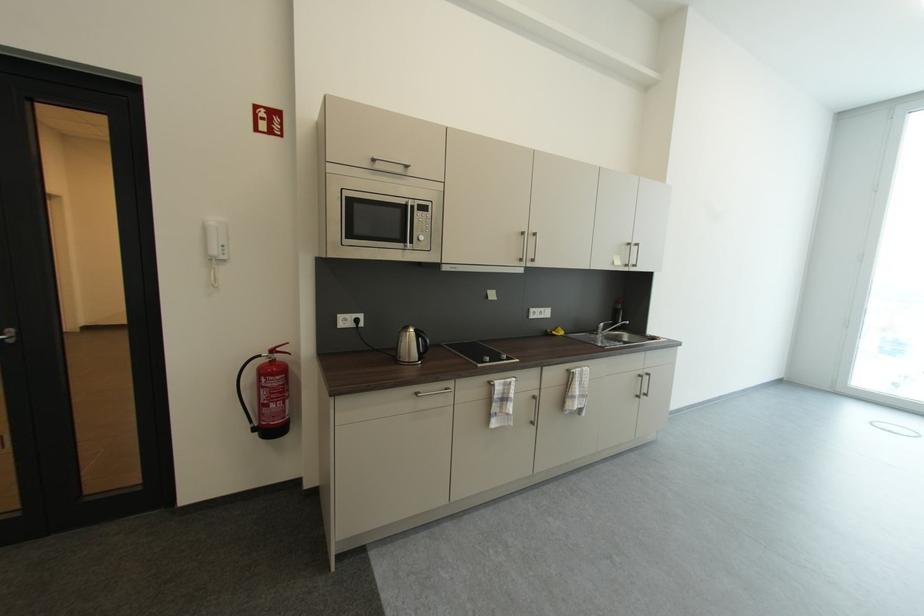
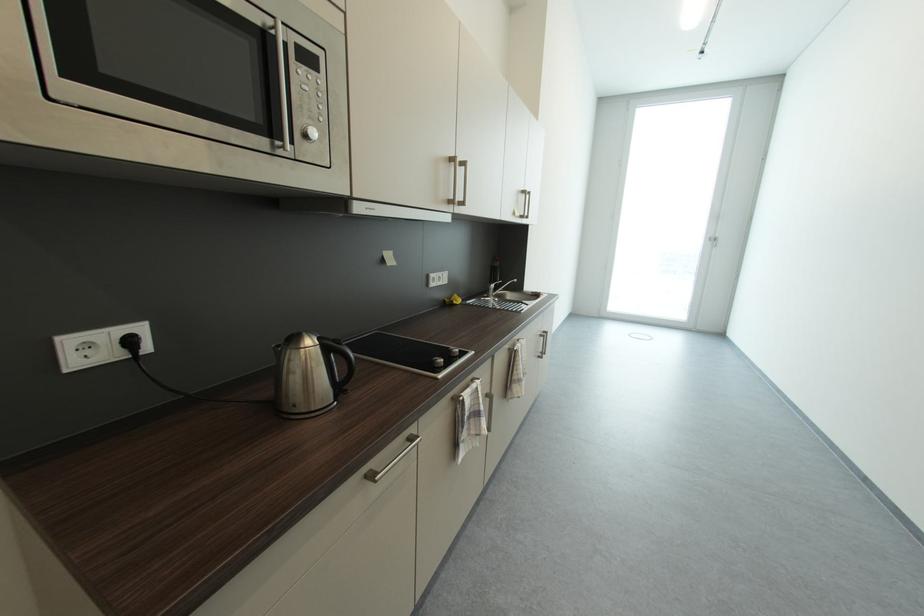
Where in the second image is the point corresponding to [579,373] from the first image?

(523, 351)